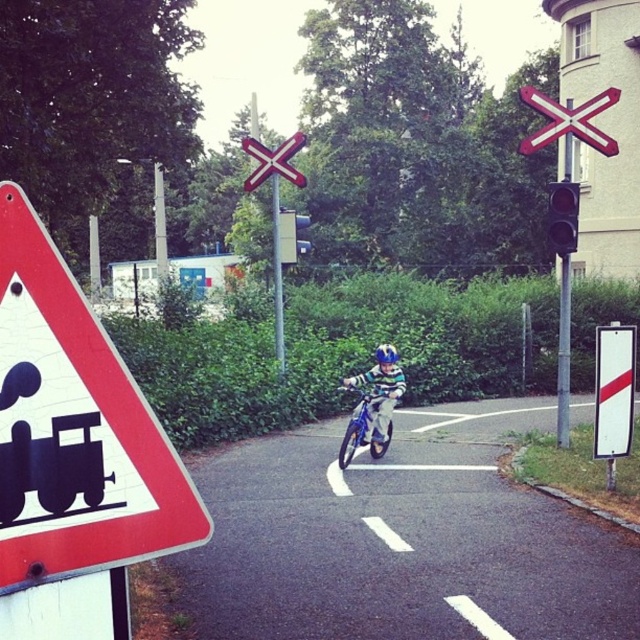
Question: Which object is farther from the camera taking this photo?

Choices:
 (A) green glass traffic light at right
 (B) metallic silver bicycle at center
 (C) brushed metal railroad crossing sign at upper center

Answer: (B)

Question: Does metallic silver dirt bike at center lie behind metallic red x at center?

Choices:
 (A) yes
 (B) no

Answer: (B)

Question: Which is nearer to the metallic silver bicycle at center?

Choices:
 (A) green glass traffic light at right
 (B) metallic traffic light at center

Answer: (A)

Question: Can you confirm if metallic silver bicycle at center is thinner than green glass traffic light at right?

Choices:
 (A) no
 (B) yes

Answer: (A)

Question: Can you confirm if red triangle sign at left is thinner than metallic traffic light at center?

Choices:
 (A) no
 (B) yes

Answer: (B)

Question: Which point appears closest to the camera in this image?

Choices:
 (A) (552, 221)
 (B) (358, 416)

Answer: (B)